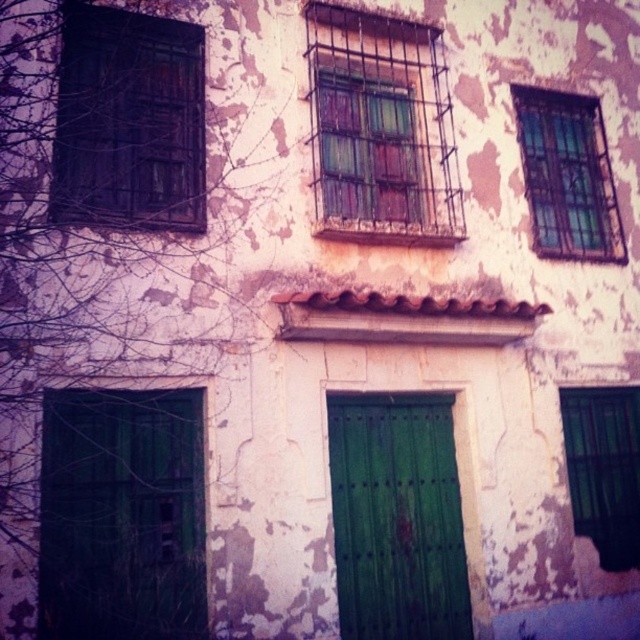
You are a delivery person with a package that requires a 3 meter wide space to maneuver. You see the matte metal bars at center and the green wooden door at lower left. Is there enough space between them to move your delivery vehicle through?

The matte metal bars at center and green wooden door at lower left are 2.93 meters apart from each other, so there is not enough space for the delivery vehicle that requires 3 meters to maneuver.

You are a delivery person with a package that requires a signature. You need to reach the green wooden door at lower left from the clear glass window at upper right. Can you walk straight towards the door without any obstacles between them?

The distance between the clear glass window at upper right and the green wooden door at lower left is 1.89 meters. Since there are no objects mentioned between them in the scene description, you can walk straight towards the door.